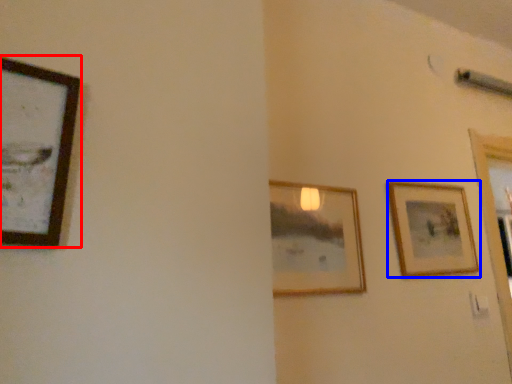
Question: Which of the following is the closest to the observer, picture frame (highlighted by a red box) or picture frame (highlighted by a blue box)?

Choices:
 (A) picture frame
 (B) picture frame

Answer: (A)